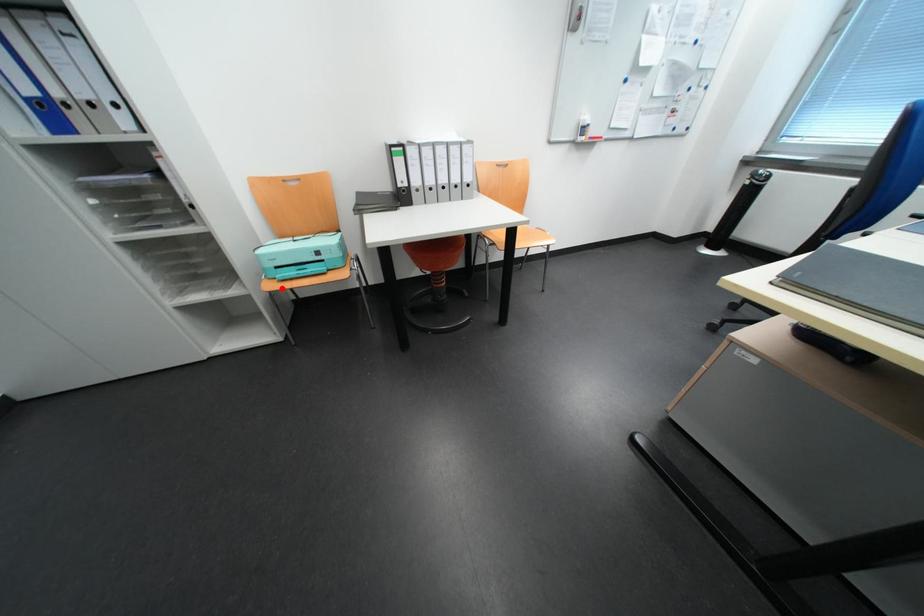
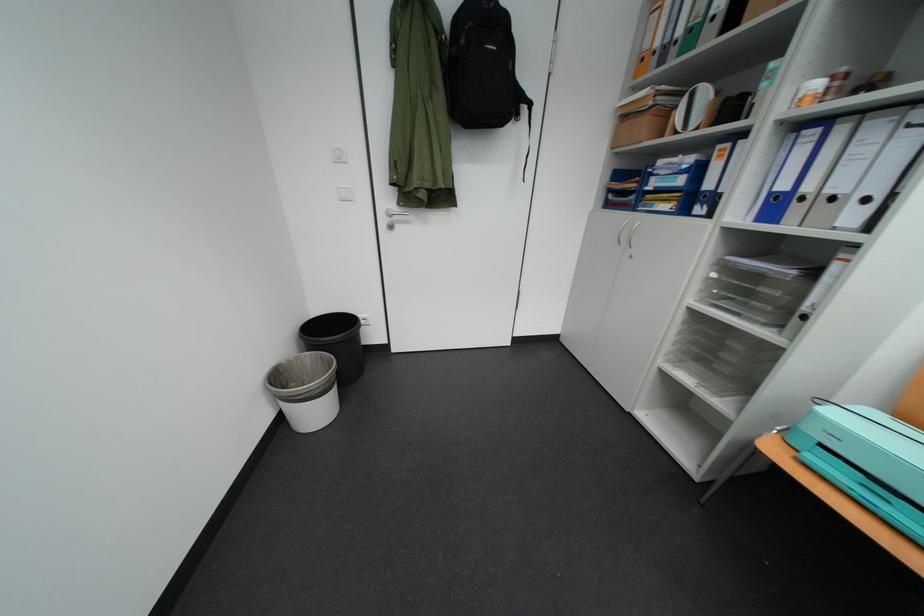
Question: A red point is marked in image1. In image2, is the corresponding 3D point closer to the camera or farther? Reply with the corresponding letter.

Choices:
 (A) The corresponding 3D point is closer.
 (B) The corresponding 3D point is farther.

Answer: (B)